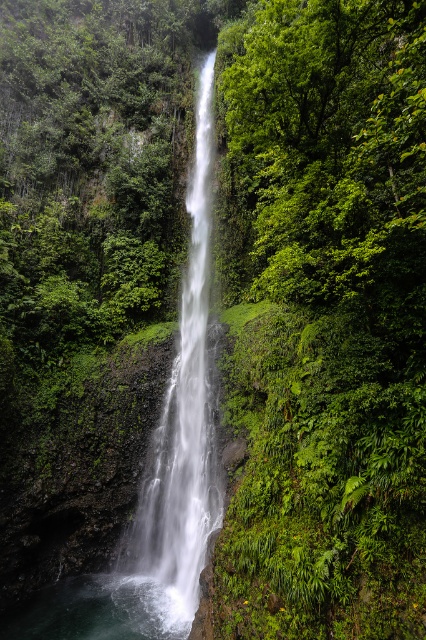
Question: Which point appears farthest from the camera in this image?

Choices:
 (A) (74, 612)
 (B) (166, 454)

Answer: (B)

Question: Can you confirm if white smooth waterfall at center is bigger than clear water at bottom center?

Choices:
 (A) yes
 (B) no

Answer: (A)

Question: Can you confirm if white smooth waterfall at center is thinner than clear water at bottom center?

Choices:
 (A) yes
 (B) no

Answer: (B)

Question: Is white smooth waterfall at center below clear water at bottom center?

Choices:
 (A) no
 (B) yes

Answer: (A)